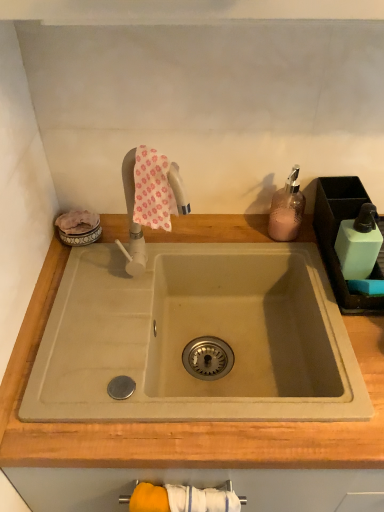
Locate an element on the screen. blank space to the left of pink textured soap dispenser at upper right is located at coordinates (227, 234).